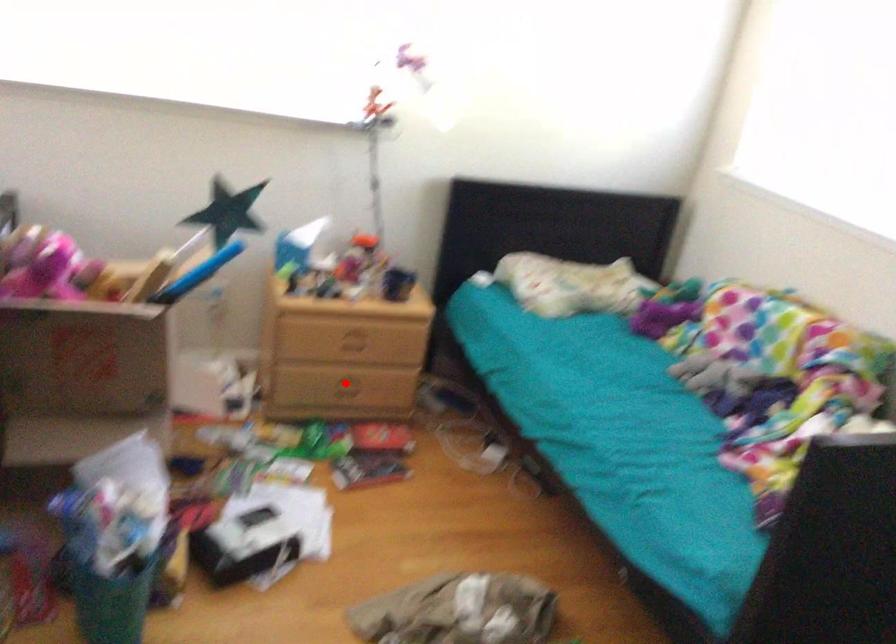
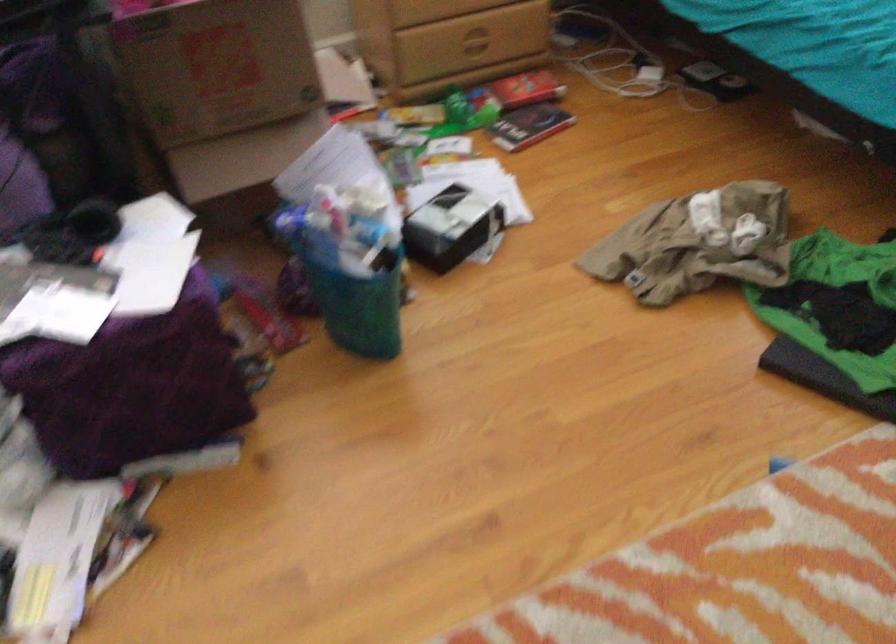
Question: I am providing you with two images of the same scene from different viewpoints. In image1, a red point is highlighted. Considering the same 3D point in image2, which of the following is correct?

Choices:
 (A) It is closer
 (B) It is farther

Answer: (A)